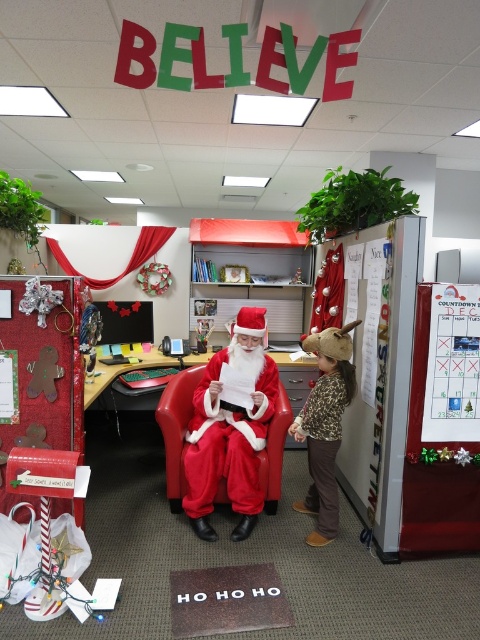
What is the location of the point with coordinates (x=230, y=429) in the festive office cubicle scene?

The point with coordinates (x=230, y=429) is located on fuzzy red santa at center.

You are a visitor in the office and want to take a photo of both the fuzzy red santa at center and the leopard print sweater at center. Can you position yourself so that both are visible in the same frame?

The fuzzy red santa at center is located above the leopard print sweater at center, so yes, you can position yourself to see both in the same frame by angling the camera upwards to include both the upper and lower parts of the scene.